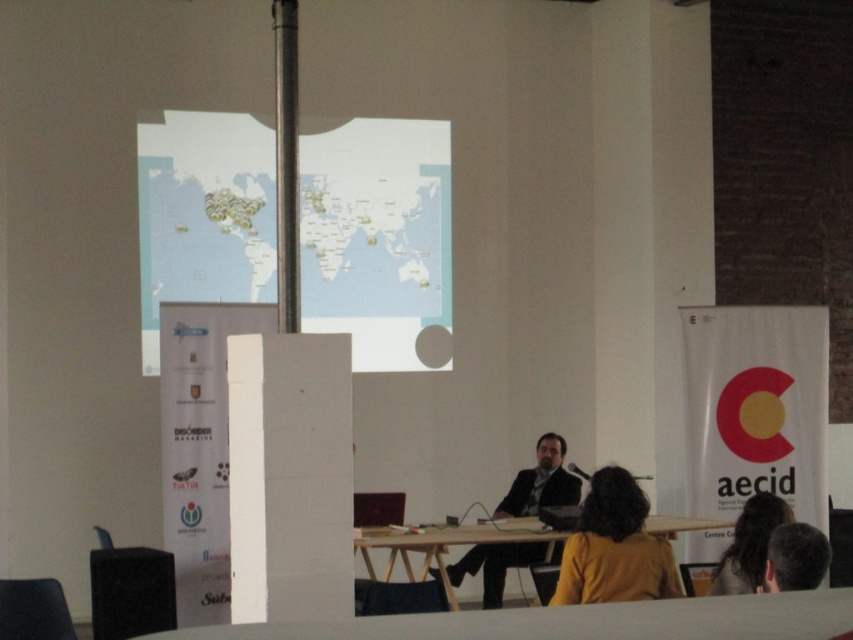
Is point (595, 544) more distant than point (766, 492)?

No, (595, 544) is closer to viewer.

Which is below, yellow fabric jacket at center or dark brown hair at lower right?

yellow fabric jacket at center is below.

Between point (651, 566) and point (740, 582), which one is positioned behind?

The point (740, 582) is behind.

Locate an element on the screen. yellow fabric jacket at center is located at coordinates (614, 547).

Can you confirm if yellow fabric jacket at center is positioned above gray hair at upper right?

Actually, yellow fabric jacket at center is below gray hair at upper right.

Does yellow fabric jacket at center appear under gray hair at upper right?

Yes.

Is point (599, 595) closer to camera compared to point (773, 547)?

No, (599, 595) is further to viewer.

Locate an element on the screen. yellow fabric jacket at center is located at coordinates (614, 547).

Is wooden at center thinner than dark brown hair at lower right?

No.

Measure the distance between wooden at center and camera.

The distance of wooden at center from camera is 7.05 meters.

Find the location of a particular element. wooden at center is located at coordinates (444, 545).